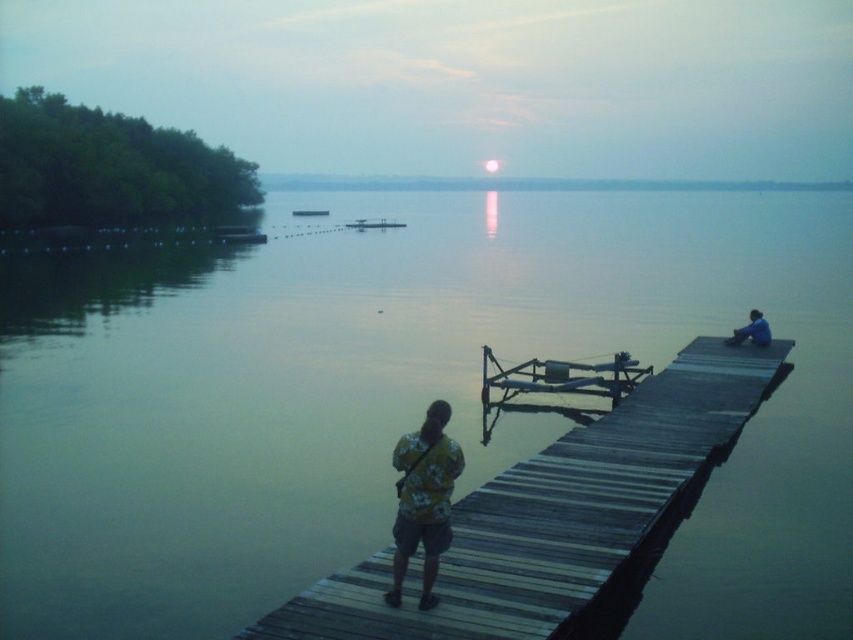
Question: Can you confirm if smooth water at center is bigger than wooden dock at center?

Choices:
 (A) no
 (B) yes

Answer: (B)

Question: Which point is closer to the camera?

Choices:
 (A) (202, 637)
 (B) (410, 536)

Answer: (B)

Question: Is smooth water at center in front of blue fabric shirt at right?

Choices:
 (A) yes
 (B) no

Answer: (A)

Question: Which point is farther to the camera?

Choices:
 (A) blue fabric shirt at right
 (B) wooden dock at center

Answer: (A)

Question: Observing the image, what is the correct spatial positioning of smooth water at center in reference to blue fabric shirt at right?

Choices:
 (A) right
 (B) left

Answer: (B)

Question: Which of the following is the closest to the observer?

Choices:
 (A) (637, 292)
 (B) (451, 484)
 (C) (618, 560)

Answer: (B)